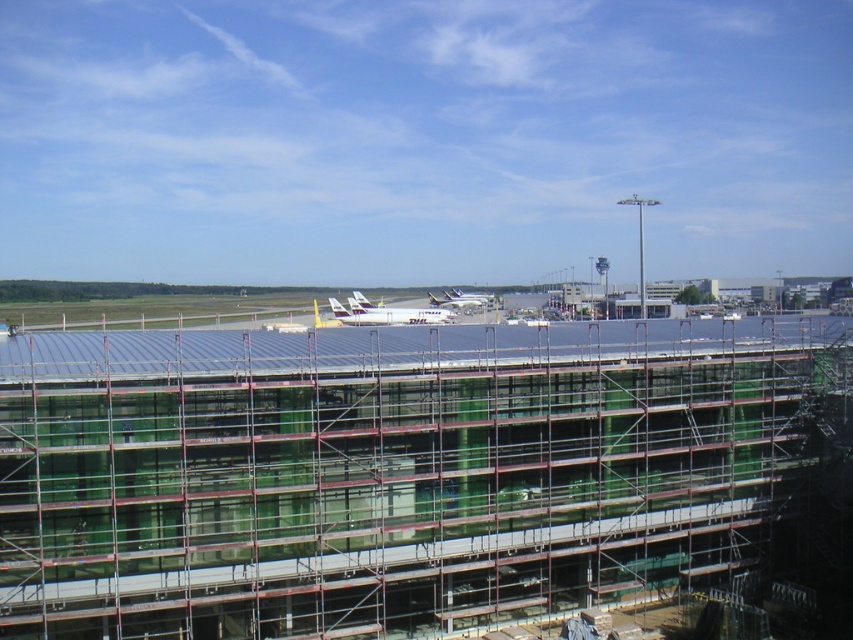
Between white matte airplane at center and white glossy airplane at center, which one is positioned lower?

white matte airplane at center

What do you see at coordinates (386, 314) in the screenshot? This screenshot has width=853, height=640. I see `white matte airplane at center` at bounding box center [386, 314].

Between point (375, 317) and point (438, 301), which one is positioned behind?

Point (438, 301)

You are a GUI agent. You are given a task and a screenshot of the screen. Output one action in this format:
    pyautogui.click(x=<x>, y=<y>)
    Task: Click on the white matte airplane at center
    The width and height of the screenshot is (853, 640).
    Given the screenshot: What is the action you would take?
    pyautogui.click(x=386, y=314)

Does green glass building at center have a larger size compared to white glossy airplane at center?

Yes, green glass building at center is bigger than white glossy airplane at center.

Is green glass building at center behind white glossy airplane at center?

No, it is not.

Between point (527, 371) and point (486, 296), which one is positioned in front?

Point (527, 371) is in front.

The width and height of the screenshot is (853, 640). In order to click on green glass building at center in this screenshot , I will do `click(392, 470)`.

Looking at this image, can you confirm if green glass building at center is positioned below white matte airplane at center?

Indeed, green glass building at center is positioned under white matte airplane at center.

Is green glass building at center shorter than white matte airplane at center?

In fact, green glass building at center may be taller than white matte airplane at center.

What do you see at coordinates (392, 470) in the screenshot? This screenshot has height=640, width=853. I see `green glass building at center` at bounding box center [392, 470].

This screenshot has width=853, height=640. I want to click on green glass building at center, so [x=392, y=470].